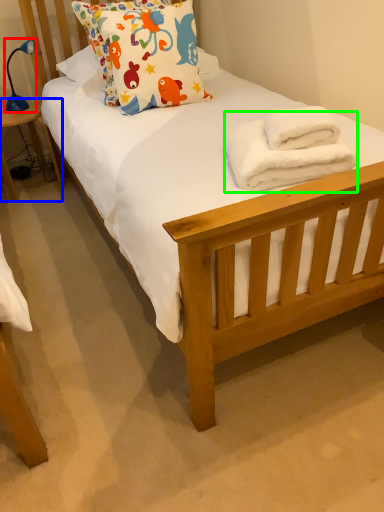
Question: Which object is positioned closest to lamp (highlighted by a red box)? Select from table (highlighted by a blue box) and bath towel (highlighted by a green box).

Choices:
 (A) table
 (B) bath towel

Answer: (A)